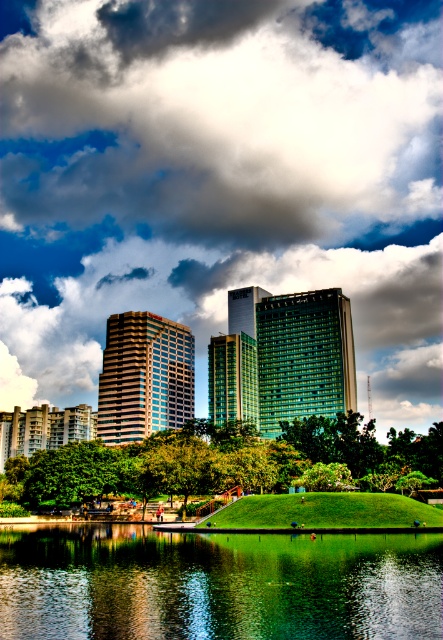
You are standing at the point marked by the coordinate point (x=217, y=584) in the image. What do you see directly in front of you?

The point (x=217, y=584) marks green reflective water at center, so standing there you would see the green reflective water directly in front of you.

You are standing in the park and want to take a photo of both the green reflective water at center and the green leafy tree at center. Which object should you focus on first to ensure both are in frame?

You should focus on the green leafy tree at center first because it is above the green reflective water at center, so adjusting your camera angle to include the tree will naturally include the water below it.